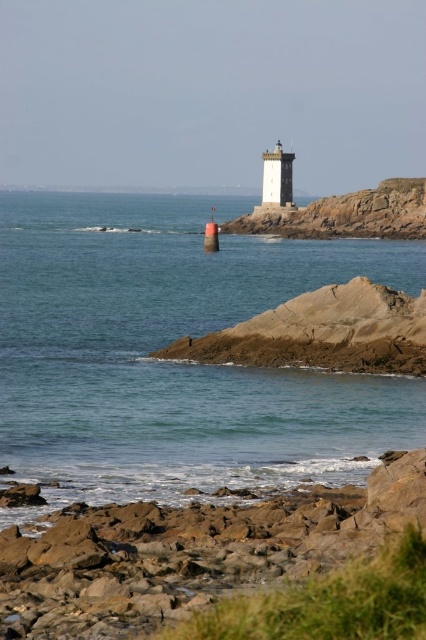
Who is lower down, clear blue water at center or brown rock cliff at center?

clear blue water at center is below.

Is clear blue water at center wider than brown rock cliff at center?

Correct, the width of clear blue water at center exceeds that of brown rock cliff at center.

Which is in front, point (284, 374) or point (402, 189)?

Point (284, 374) is more forward.

This screenshot has height=640, width=426. Find the location of `clear blue water at center`. clear blue water at center is located at coordinates (176, 362).

Can you confirm if clear blue water at center is positioned above brown rough rocks at lower left?

Yes.

Looking at this image, between clear blue water at center and brown rough rocks at lower left, which one has more height?

Standing taller between the two is clear blue water at center.

At what (x,y) coordinates should I click in order to perform the action: click on clear blue water at center. Please return your answer as a coordinate pair (x, y). Looking at the image, I should click on (176, 362).

Locate an element on the screen. The height and width of the screenshot is (640, 426). clear blue water at center is located at coordinates (176, 362).

Does brown rough rocks at lower left appear under brown rock cliff at center?

Yes.

Who is more distant from viewer, (276, 566) or (249, 228)?

The point (249, 228) is behind.

Does point (77, 570) come farther from viewer compared to point (402, 216)?

No, (77, 570) is in front of (402, 216).

Identify the location of brown rough rocks at lower left. The width and height of the screenshot is (426, 640). tap(190, 552).